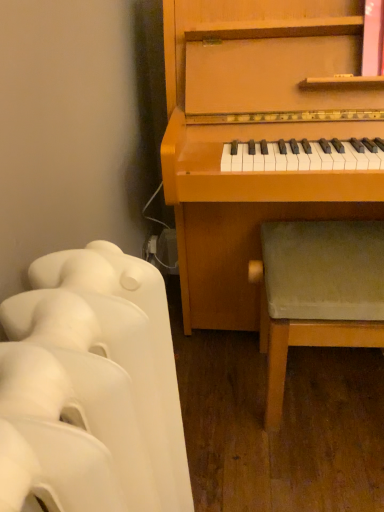
Question: Considering the positions of point (87, 422) and point (268, 373), is point (87, 422) closer or farther from the camera than point (268, 373)?

Choices:
 (A) closer
 (B) farther

Answer: (A)

Question: In terms of size, does white matte radiator at lower left appear bigger or smaller than green fabric stool at lower right?

Choices:
 (A) small
 (B) big

Answer: (A)

Question: From the image's perspective, relative to green fabric stool at lower right, is white matte radiator at lower left above or below?

Choices:
 (A) below
 (B) above

Answer: (A)

Question: From a real-world perspective, is green fabric stool at lower right physically located above or below white matte radiator at lower left?

Choices:
 (A) above
 (B) below

Answer: (B)

Question: Considering the positions of green fabric stool at lower right and white matte radiator at lower left in the image, is green fabric stool at lower right bigger or smaller than white matte radiator at lower left?

Choices:
 (A) small
 (B) big

Answer: (B)

Question: In terms of height, does green fabric stool at lower right look taller or shorter compared to white matte radiator at lower left?

Choices:
 (A) short
 (B) tall

Answer: (A)

Question: Considering the positions of point (329, 346) and point (97, 423), is point (329, 346) closer or farther from the camera than point (97, 423)?

Choices:
 (A) farther
 (B) closer

Answer: (A)